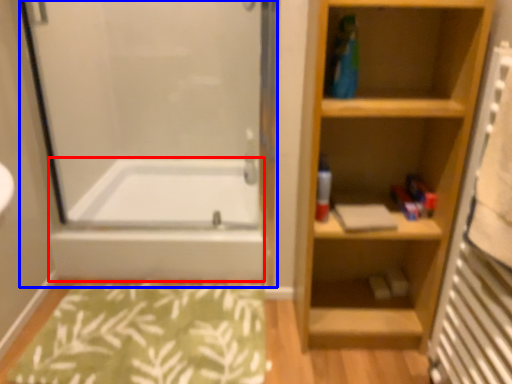
Question: Which of the following is the closest to the observer, bathtub (highlighted by a red box) or screen door (highlighted by a blue box)?

Choices:
 (A) bathtub
 (B) screen door

Answer: (B)